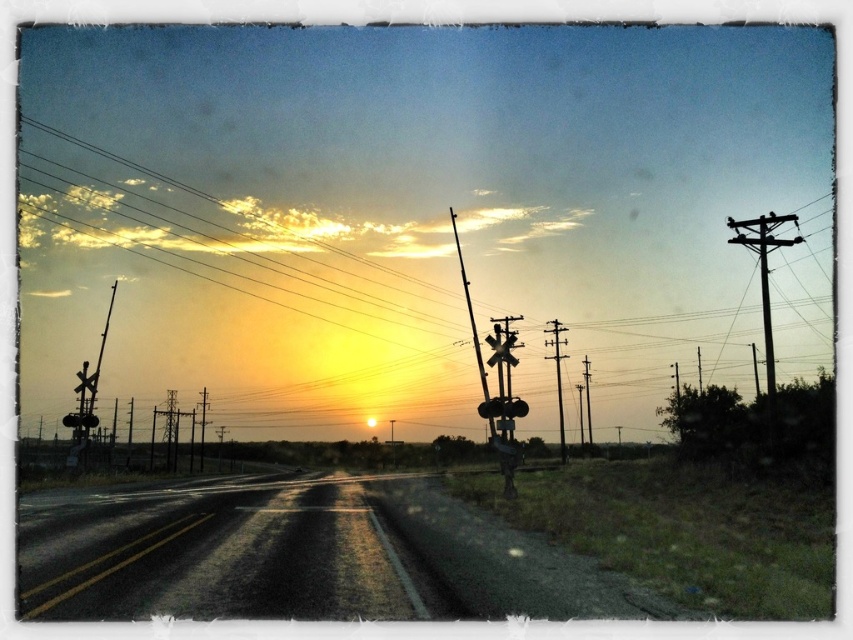
Question: Which point appears closest to the camera in this image?

Choices:
 (A) (548, 330)
 (B) (503, 353)
 (C) (773, 388)

Answer: (B)

Question: Is black asphalt road at center above silhouette wooden pole at right?

Choices:
 (A) yes
 (B) no

Answer: (B)

Question: Based on their relative distances, which object is farther from the black matte traffic light at center?

Choices:
 (A) black asphalt road at center
 (B) silhouette wooden pole at right
 (C) smooth wood telegraph pole at center right

Answer: (B)

Question: Which point appears farthest from the camera in this image?

Choices:
 (A) (770, 250)
 (B) (498, 356)
 (C) (556, 333)
 (D) (503, 403)

Answer: (C)

Question: Is smooth wood telegraph pole at center right bigger than metallic traffic light at center?

Choices:
 (A) no
 (B) yes

Answer: (B)

Question: Is silhouette wooden pole at right to the right of black matte traffic light at center from the viewer's perspective?

Choices:
 (A) no
 (B) yes

Answer: (B)